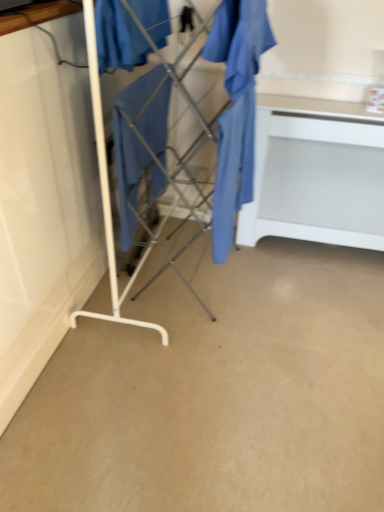
Locate an element on the screen. This screenshot has width=384, height=512. free space that is in between white matte table at center and metal drying rack at center is located at coordinates [x=276, y=274].